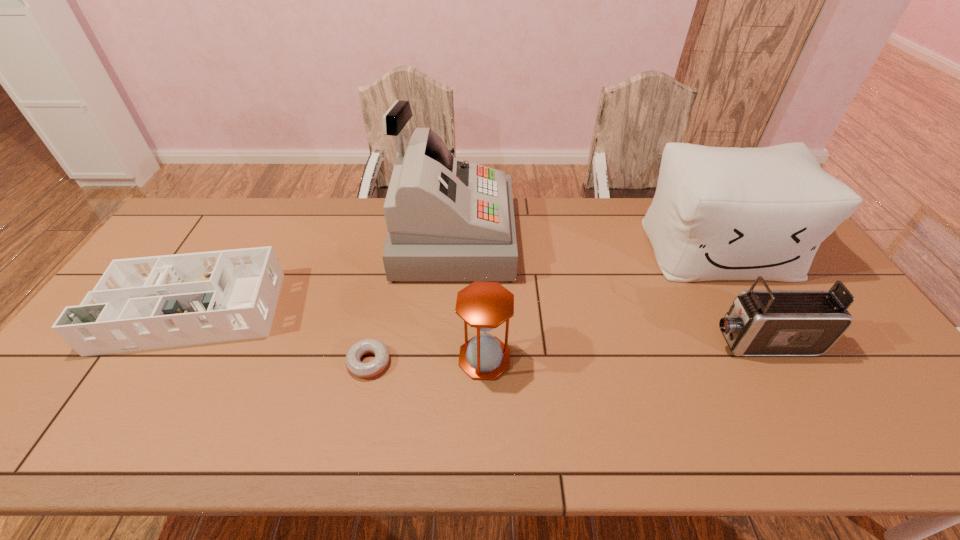
What are the coordinates of `cash register` in the screenshot? It's located at (448, 219).

At what (x,y) coordinates should I click in order to perform the action: click on cushion. Please return your answer as a coordinate pair (x, y). The width and height of the screenshot is (960, 540). Looking at the image, I should click on (718, 213).

I want to click on camcorder, so click(x=768, y=322).

The height and width of the screenshot is (540, 960). I want to click on hourglass, so click(x=483, y=305).

The image size is (960, 540). I want to click on the leftmost object, so click(x=143, y=303).

Image resolution: width=960 pixels, height=540 pixels. Identify the location of dollhouse. (143, 303).

Locate an element on the screen. The height and width of the screenshot is (540, 960). the shortest object is located at coordinates tap(360, 369).

Find the location of a particular element. This screenshot has height=540, width=960. free region located on the keypad side of the cash register is located at coordinates (549, 239).

Identify the location of blank area located on the side of the fifth shortest object with the smiley face. (795, 380).

At what (x,y) coordinates should I click in order to perform the action: click on free location located 0.210m at the lens of the camcorder. Please return your answer as a coordinate pair (x, y). Looking at the image, I should click on (627, 342).